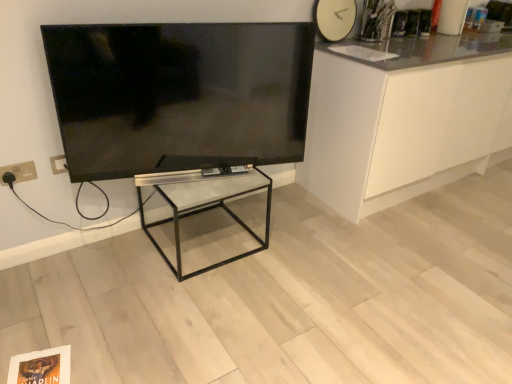
Identify the location of free space that is in between clear glass table at center and white glossy cabinet at right. The height and width of the screenshot is (384, 512). (285, 223).